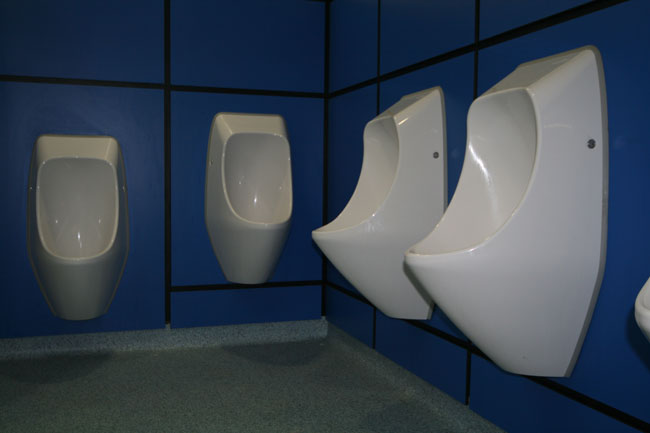
Locate an element on the screen. The width and height of the screenshot is (650, 433). shadow of urinal is located at coordinates (413, 421), (357, 372), (289, 353), (55, 369).